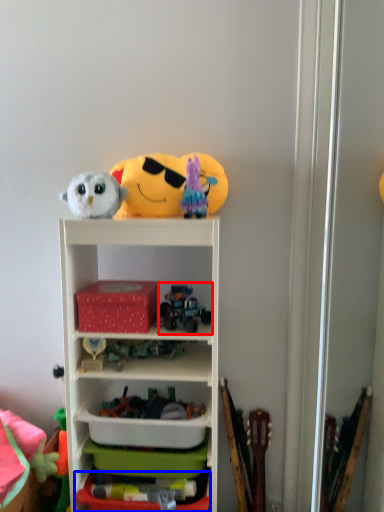
Question: Among these objects, which one is nearest to the camera, toy (highlighted by a red box) or storage box (highlighted by a blue box)?

Choices:
 (A) toy
 (B) storage box

Answer: (B)